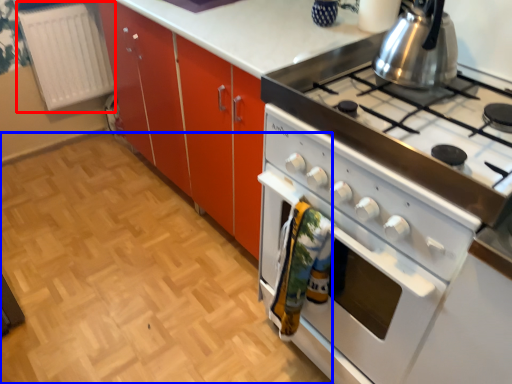
Question: Which object appears farthest to the camera in this image, radiator (highlighted by a red box) or plain (highlighted by a blue box)?

Choices:
 (A) radiator
 (B) plain

Answer: (A)